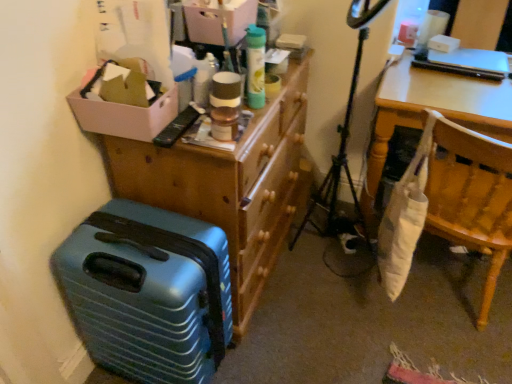
This screenshot has height=384, width=512. What are the coordinates of `free space to the right of teal matte suitcase at lower left` in the screenshot? It's located at (287, 340).